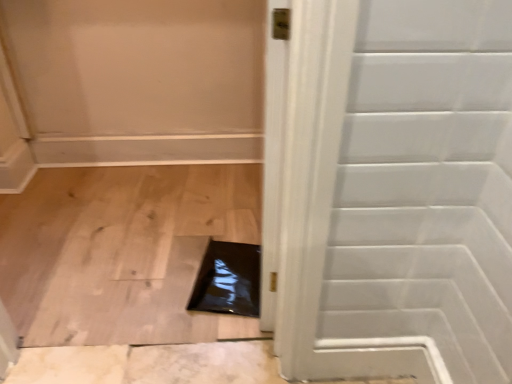
Describe the element at coordinates (228, 280) in the screenshot. The width and height of the screenshot is (512, 384). I see `black glossy hole at center` at that location.

At what (x,y) coordinates should I click in order to perform the action: click on black glossy hole at center. Please return your answer as a coordinate pair (x, y). Looking at the image, I should click on (228, 280).

This screenshot has height=384, width=512. Describe the element at coordinates (397, 192) in the screenshot. I see `white glossy door at center` at that location.

You are a GUI agent. You are given a task and a screenshot of the screen. Output one action in this format:
    pyautogui.click(x=<x>, y=<y>)
    Task: Click on the white glossy door at center
    This screenshot has width=512, height=384.
    Given the screenshot: What is the action you would take?
    pyautogui.click(x=397, y=192)

This screenshot has height=384, width=512. In order to click on black glossy hole at center in this screenshot , I will do `click(228, 280)`.

Considering the positions of objects white glossy door at center and black glossy hole at center in the image provided, who is more to the left, white glossy door at center or black glossy hole at center?

From the viewer's perspective, black glossy hole at center appears more on the left side.

In the image, is white glossy door at center positioned in front of or behind black glossy hole at center?

white glossy door at center is in front of black glossy hole at center.

Is point (463, 25) positioned behind point (195, 292)?

No, it is in front of (195, 292).

From the image's perspective, is white glossy door at center on black glossy hole at center?

Indeed, from the image's perspective, white glossy door at center is shown above black glossy hole at center.

Consider the image. From a real-world perspective, is white glossy door at center over black glossy hole at center?

Correct, in the physical world, white glossy door at center is higher than black glossy hole at center.

Between white glossy door at center and black glossy hole at center, which one has larger width?

Wider between the two is black glossy hole at center.

Is white glossy door at center shorter than black glossy hole at center?

No, white glossy door at center is not shorter than black glossy hole at center.

Between white glossy door at center and black glossy hole at center, which one has larger size?

With larger size is white glossy door at center.

Is white glossy door at center inside the boundaries of black glossy hole at center, or outside?

white glossy door at center is not enclosed by black glossy hole at center.

Is white glossy door at center far from black glossy hole at center?

white glossy door at center is actually quite close to black glossy hole at center.

Is white glossy door at center facing away from black glossy hole at center?

No, black glossy hole at center is not at the back of white glossy door at center.

Can you tell me how much white glossy door at center and black glossy hole at center differ in facing direction?

The angle between the facing direction of white glossy door at center and the facing direction of black glossy hole at center is 94.6 degrees.

I want to click on door on the right of the black glossy hole at center, so (x=397, y=192).

Which is more to the left, black glossy hole at center or white glossy door at center?

From the viewer's perspective, black glossy hole at center appears more on the left side.

Is black glossy hole at center closer to camera compared to white glossy door at center?

No, black glossy hole at center is further to the viewer.

Does point (250, 247) appear closer or farther from the camera than point (456, 322)?

Point (250, 247) appears to be farther away from the viewer than point (456, 322).

From the image's perspective, which object appears higher, black glossy hole at center or white glossy door at center?

From the image's view, white glossy door at center is above.

Looking at this image, from a real-world perspective, is black glossy hole at center positioned over white glossy door at center based on gravity?

No, from a real-world perspective, black glossy hole at center is not over white glossy door at center

Does black glossy hole at center have a lesser width compared to white glossy door at center?

Incorrect, the width of black glossy hole at center is not less than that of white glossy door at center.

Does black glossy hole at center have a greater height compared to white glossy door at center?

Incorrect, the height of black glossy hole at center is not larger of that of white glossy door at center.

Who is bigger, black glossy hole at center or white glossy door at center?

Bigger between the two is white glossy door at center.

Is black glossy hole at center inside or outside of white glossy door at center?

black glossy hole at center is outside white glossy door at center.

Are black glossy hole at center and white glossy door at center located far from each other?

No, black glossy hole at center is not far away from white glossy door at center.

Is black glossy hole at center positioned with its back to white glossy door at center?

No, black glossy hole at center is not facing the opposite direction of white glossy door at center.

Can you tell me how much black glossy hole at center and white glossy door at center differ in facing direction?

There is a 94.6-degree angle between the facing directions of black glossy hole at center and white glossy door at center.

How far apart are black glossy hole at center and white glossy door at center?

black glossy hole at center is 56.78 centimeters from white glossy door at center.

This screenshot has height=384, width=512. Identify the location of hole on the left of the white glossy door at center. (228, 280).

What are the coordinates of `hole that appears behind the white glossy door at center` in the screenshot? It's located at (228, 280).

Locate an element on the screen. door in front of the black glossy hole at center is located at coordinates (397, 192).